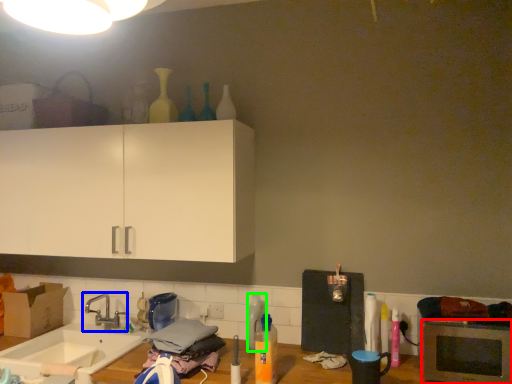
Question: Estimate the real-world distances between objects in this image. Which object is closer to microwave oven (highlighted by a red box), tap (highlighted by a blue box) or bottle (highlighted by a green box)?

Choices:
 (A) tap
 (B) bottle

Answer: (B)